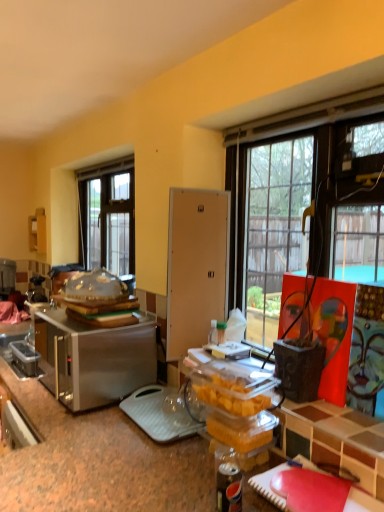
Question: From the image's perspective, would you say matte white cabinet at left is shown under satin silver toaster at left, the second appliance in the left-to-right sequence?

Choices:
 (A) yes
 (B) no

Answer: (B)

Question: Is matte white cabinet at left surrounding satin silver toaster at left, the second appliance in the left-to-right sequence?

Choices:
 (A) yes
 (B) no

Answer: (B)

Question: Is matte white cabinet at left not close to satin silver toaster at left, the second appliance in the left-to-right sequence?

Choices:
 (A) yes
 (B) no

Answer: (A)

Question: Is the depth of matte white cabinet at left greater than that of satin silver toaster at left, marked as the first appliance in a front-to-back arrangement?

Choices:
 (A) no
 (B) yes

Answer: (B)

Question: Is matte white cabinet at left shorter than satin silver toaster at left, marked as the first appliance in a front-to-back arrangement?

Choices:
 (A) no
 (B) yes

Answer: (A)

Question: From a real-world perspective, is brushed metal toaster at left, the first appliance viewed from the left, physically located above or below matte white cabinet at left?

Choices:
 (A) above
 (B) below

Answer: (B)

Question: In terms of width, does brushed metal toaster at left, which appears as the second appliance when viewed from the right, look wider or thinner when compared to matte white cabinet at left?

Choices:
 (A) thin
 (B) wide

Answer: (B)

Question: Which is correct: brushed metal toaster at left, the first appliance viewed from the left, is inside matte white cabinet at left, or outside of it?

Choices:
 (A) inside
 (B) outside

Answer: (B)

Question: Is brushed metal toaster at left, which is the 1th appliance from back to front, in front of or behind matte white cabinet at left in the image?

Choices:
 (A) behind
 (B) front

Answer: (B)

Question: Based on their positions, is matte white cabinet at left located to the left or right of brushed metal toaster at left, which appears as the second appliance when viewed from the right?

Choices:
 (A) right
 (B) left

Answer: (A)

Question: From the image's perspective, relative to brushed metal toaster at left, which is the 1th appliance from back to front, is matte white cabinet at left above or below?

Choices:
 (A) above
 (B) below

Answer: (A)

Question: Looking at the image, does matte white cabinet at left seem bigger or smaller compared to brushed metal toaster at left, which appears as the second appliance when viewed from the right?

Choices:
 (A) big
 (B) small

Answer: (B)

Question: Considering the positions of matte white cabinet at left and brushed metal toaster at left, the 2th appliance positioned from the front, in the image, is matte white cabinet at left taller or shorter than brushed metal toaster at left, the 2th appliance positioned from the front,?

Choices:
 (A) tall
 (B) short

Answer: (A)

Question: Looking at the image, does satin silver toaster at left, the second appliance in the left-to-right sequence, seem bigger or smaller compared to brushed metal toaster at left, the 2th appliance positioned from the front?

Choices:
 (A) small
 (B) big

Answer: (B)

Question: Is satin silver toaster at left, marked as the first appliance in a front-to-back arrangement, to the left or to the right of brushed metal toaster at left, which appears as the second appliance when viewed from the right, in the image?

Choices:
 (A) left
 (B) right

Answer: (B)